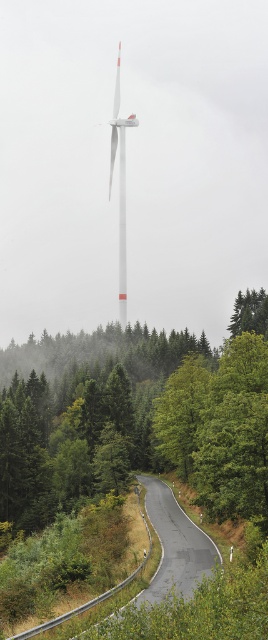
Question: Does green matte tree at center appear on the right side of white matte wind turbine at center?

Choices:
 (A) no
 (B) yes

Answer: (B)

Question: Is the position of green matte tree at center more distant than that of white matte wind turbine at center?

Choices:
 (A) yes
 (B) no

Answer: (B)

Question: Which object is the farthest from the green matte tree at center?

Choices:
 (A) white matte wind turbine at center
 (B) asphalt road at center

Answer: (A)

Question: Which of the following is the farthest from the observer?

Choices:
 (A) green matte tree at center
 (B) white matte wind turbine at center

Answer: (B)

Question: Which object is the farthest from the green matte tree at center?

Choices:
 (A) white matte wind turbine at center
 (B) asphalt road at center

Answer: (A)

Question: Is green matte tree at center above white matte wind turbine at center?

Choices:
 (A) yes
 (B) no

Answer: (B)